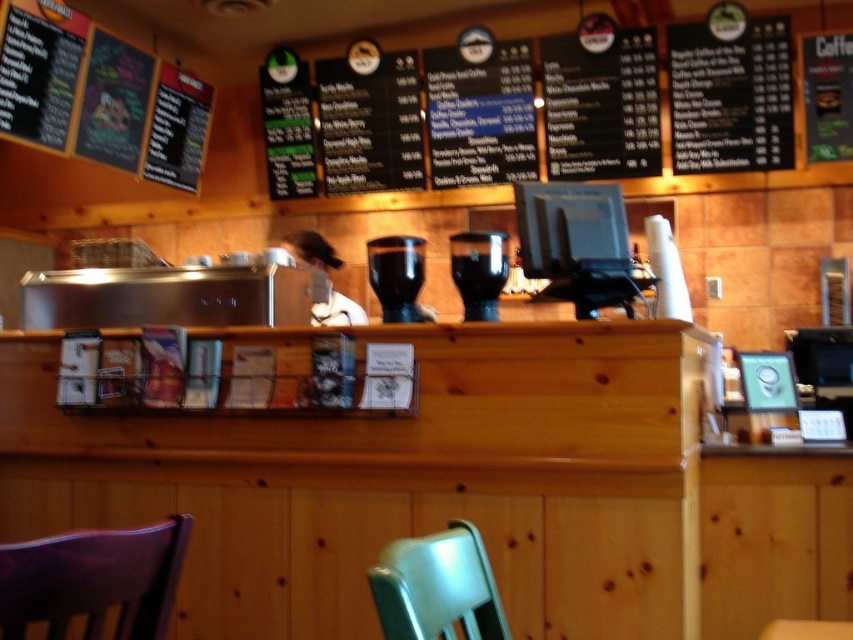
Which is above, black matte coffee machine at center or black glass coffee machine at center?

black glass coffee machine at center is higher up.

Does point (416, 241) lie behind point (483, 298)?

Yes, it is.

In order to click on black matte coffee machine at center in this screenshot , I will do `click(397, 276)`.

Can you confirm if purple leather chair at lower left is smaller than white fabric shirt at center?

Yes, purple leather chair at lower left is smaller than white fabric shirt at center.

I want to click on purple leather chair at lower left, so click(x=94, y=579).

Can you confirm if metallic green chair at lower center is positioned to the left of black matte coffee machine at center?

Incorrect, metallic green chair at lower center is not on the left side of black matte coffee machine at center.

The image size is (853, 640). Describe the element at coordinates (437, 588) in the screenshot. I see `metallic green chair at lower center` at that location.

You are a GUI agent. You are given a task and a screenshot of the screen. Output one action in this format:
    pyautogui.click(x=<x>, y=<y>)
    Task: Click on the metallic green chair at lower center
    This screenshot has height=640, width=853.
    Given the screenshot: What is the action you would take?
    pyautogui.click(x=437, y=588)